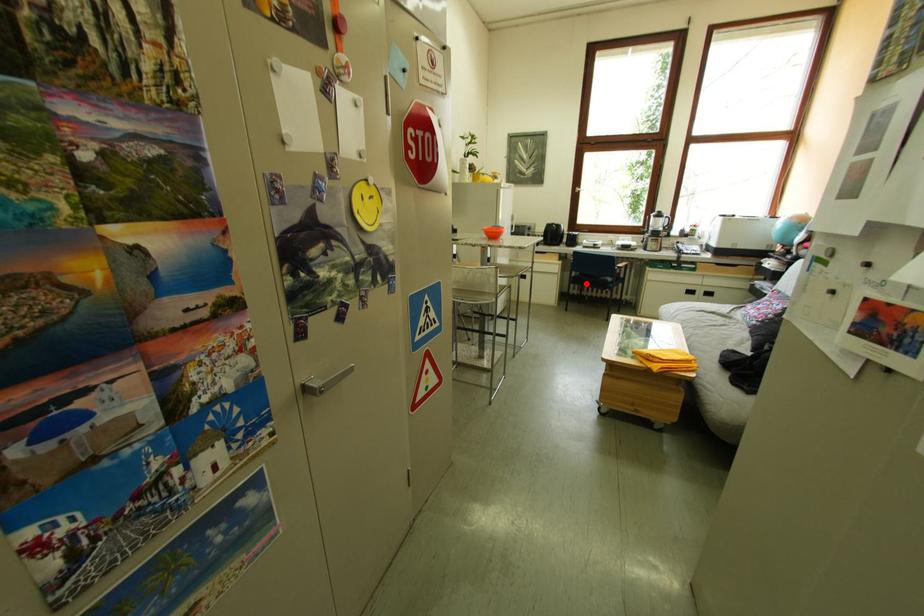
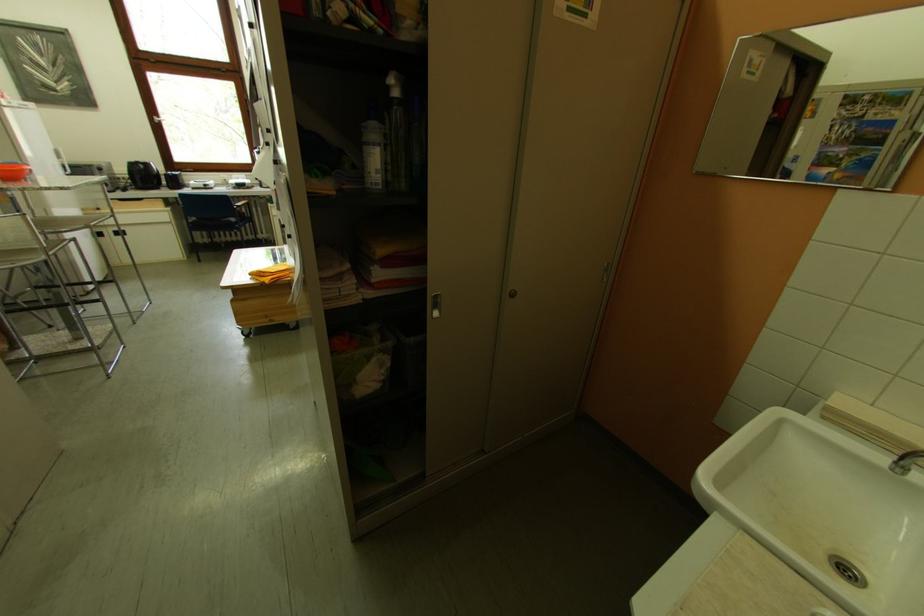
In the second image, find the point that corresponds to the highlighted location in the first image.

(207, 230)